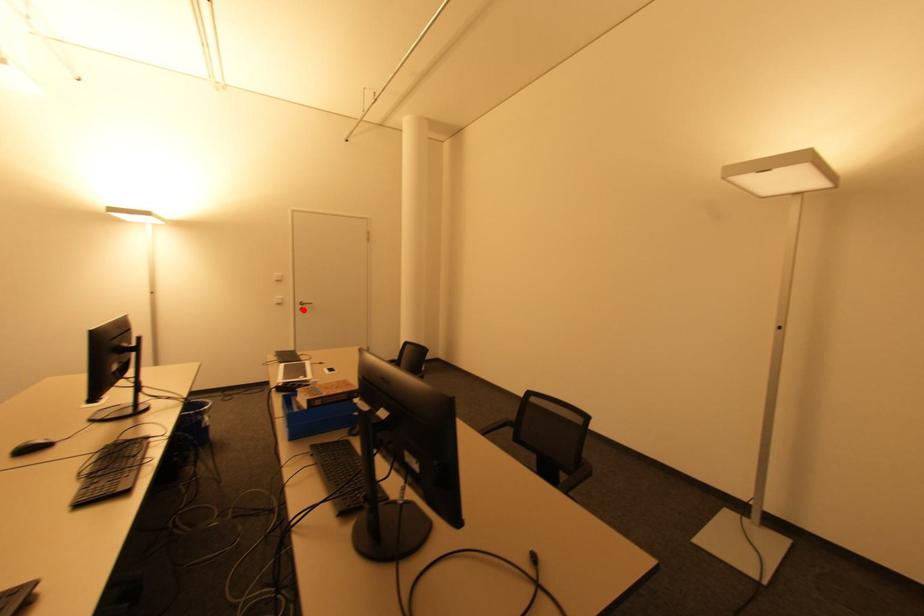
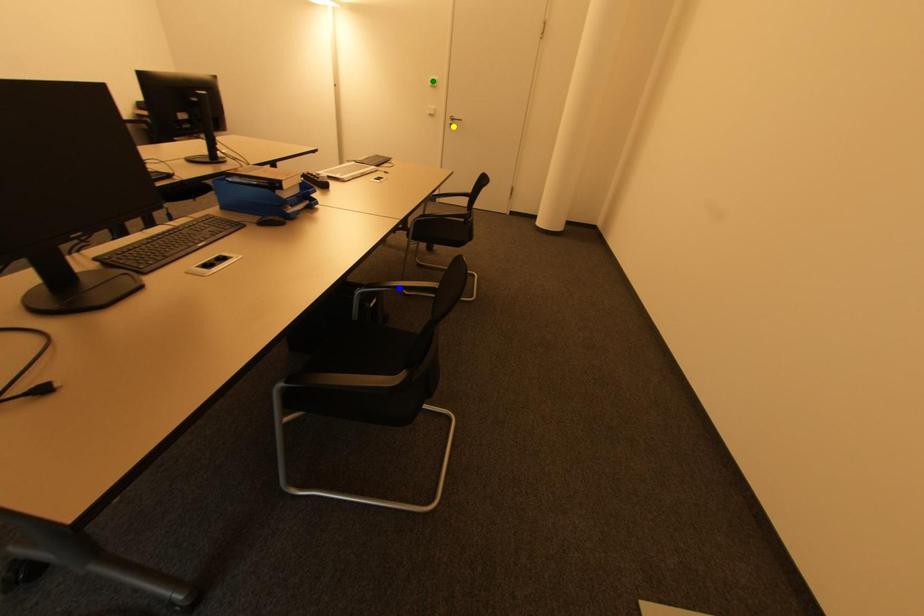
Question: I am providing you with two images of the same scene from different viewpoints. A red point is marked on the first image. You are given multiple points on the second image. Which spot in image 2 lines up with the point in image 1?

Choices:
 (A) blue point
 (B) yellow point
 (C) green point

Answer: (B)